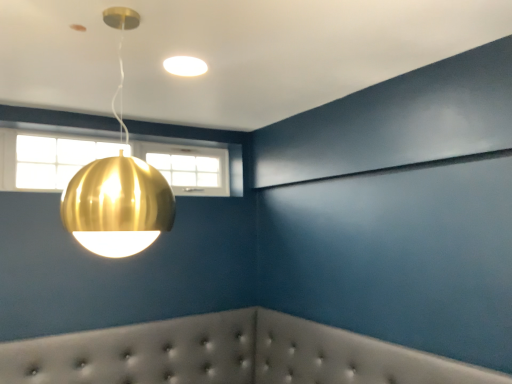
This screenshot has height=384, width=512. Describe the element at coordinates (56, 160) in the screenshot. I see `clear glass window at upper left` at that location.

I want to click on white tufted headboard at lower center, so click(228, 355).

Where is `gold metallic sphere at upper center, the 1th lamp from the bottom`? Image resolution: width=512 pixels, height=384 pixels. gold metallic sphere at upper center, the 1th lamp from the bottom is located at coordinates (117, 206).

Is gold metallic sphere at upper center, which appears as the first lamp when viewed from the front, wider or thinner than clear glass window at upper left?

Clearly, gold metallic sphere at upper center, which appears as the first lamp when viewed from the front, has more width compared to clear glass window at upper left.

From the image's perspective, is gold metallic sphere at upper center, positioned as the 2th lamp in back-to-front order, over clear glass window at upper left?

No, from the image's perspective, gold metallic sphere at upper center, positioned as the 2th lamp in back-to-front order, is not on top of clear glass window at upper left.

Is gold metallic sphere at upper center, the 2th lamp positioned from the top, oriented towards clear glass window at upper left?

No.

You are a GUI agent. You are given a task and a screenshot of the screen. Output one action in this format:
    pyautogui.click(x=<x>, y=<y>)
    Task: Click on the lamp that appears on the right of gold metallic sphere at upper center, which appears as the first lamp when viewed from the front
    
    Given the screenshot: What is the action you would take?
    pyautogui.click(x=185, y=66)

From the image's perspective, is matte white light fixture at upper center, the second lamp from the bottom, located beneath gold metallic sphere at upper center, the 2th lamp positioned from the top?

No.

Who is shorter, matte white light fixture at upper center, the first lamp in the top-to-bottom sequence, or gold metallic sphere at upper center, the 2th lamp positioned from the top?

Standing shorter between the two is matte white light fixture at upper center, the first lamp in the top-to-bottom sequence.

From a real-world perspective, relative to clear glass window at upper left, is matte white light fixture at upper center, the first lamp in the top-to-bottom sequence, vertically above or below?

In terms of real-world spatial position, matte white light fixture at upper center, the first lamp in the top-to-bottom sequence, is above clear glass window at upper left.

From the image's perspective, does matte white light fixture at upper center, the first lamp in the top-to-bottom sequence, appear lower than clear glass window at upper left?

No.

Does matte white light fixture at upper center, which ranks as the second lamp in front-to-back order, turn towards clear glass window at upper left?

No, matte white light fixture at upper center, which ranks as the second lamp in front-to-back order, is not aimed at clear glass window at upper left.

Is white tufted headboard at lower center situated inside gold metallic sphere at upper center, which appears as the first lamp when viewed from the front, or outside?

white tufted headboard at lower center is not inside gold metallic sphere at upper center, which appears as the first lamp when viewed from the front, it's outside.

Are white tufted headboard at lower center and gold metallic sphere at upper center, positioned as the 2th lamp in back-to-front order, located far from each other?

Yes.

Which is in front, white tufted headboard at lower center or gold metallic sphere at upper center, the 1th lamp from the bottom?

gold metallic sphere at upper center, the 1th lamp from the bottom.

Is clear glass window at upper left inside the boundaries of white tufted headboard at lower center, or outside?

clear glass window at upper left lies outside white tufted headboard at lower center.

This screenshot has height=384, width=512. What are the coordinates of `furniture on the right of the clear glass window at upper left` in the screenshot? It's located at (228, 355).

Considering the positions of objects clear glass window at upper left and white tufted headboard at lower center in the image provided, who is more to the left, clear glass window at upper left or white tufted headboard at lower center?

clear glass window at upper left is more to the left.

How different are the orientations of gold metallic sphere at upper center, positioned as the 2th lamp in back-to-front order, and matte white light fixture at upper center, the second lamp from the bottom, in degrees?

90 degrees separate the facing orientations of gold metallic sphere at upper center, positioned as the 2th lamp in back-to-front order, and matte white light fixture at upper center, the second lamp from the bottom.

Who is bigger, gold metallic sphere at upper center, which appears as the first lamp when viewed from the front, or matte white light fixture at upper center, the second lamp from the bottom?

With larger size is gold metallic sphere at upper center, which appears as the first lamp when viewed from the front.

From a real-world perspective, is gold metallic sphere at upper center, the 2th lamp positioned from the top, located higher than matte white light fixture at upper center, the first lamp in the top-to-bottom sequence?

No.

Does gold metallic sphere at upper center, positioned as the 2th lamp in back-to-front order, have a lesser height compared to matte white light fixture at upper center, which is counted as the 1th lamp, starting from the back?

No.

Does white tufted headboard at lower center appear on the left side of clear glass window at upper left?

No, white tufted headboard at lower center is not to the left of clear glass window at upper left.

Would you say white tufted headboard at lower center contains clear glass window at upper left?

Actually, clear glass window at upper left is outside white tufted headboard at lower center.

Between white tufted headboard at lower center and clear glass window at upper left, which one has larger size?

white tufted headboard at lower center is bigger.

Is white tufted headboard at lower center positioned with its back to clear glass window at upper left?

No, clear glass window at upper left is not at the back of white tufted headboard at lower center.

I want to click on window behind the gold metallic sphere at upper center, the 2th lamp positioned from the top, so tap(56, 160).

Locate an element on the screen. lamp that appears above the gold metallic sphere at upper center, the 1th lamp from the bottom (from a real-world perspective) is located at coordinates (185, 66).

From the image, which object appears to be nearer to gold metallic sphere at upper center, which appears as the first lamp when viewed from the front, white tufted headboard at lower center or clear glass window at upper left?

The object closer to gold metallic sphere at upper center, which appears as the first lamp when viewed from the front, is clear glass window at upper left.

Looking at the image, which one is located further to clear glass window at upper left, gold metallic sphere at upper center, the 1th lamp from the bottom, or white tufted headboard at lower center?

Among the two, gold metallic sphere at upper center, the 1th lamp from the bottom, is located further to clear glass window at upper left.

Which object lies nearer to the anchor point white tufted headboard at lower center, clear glass window at upper left or gold metallic sphere at upper center, positioned as the 2th lamp in back-to-front order?

clear glass window at upper left.

Which object lies nearer to the anchor point clear glass window at upper left, white tufted headboard at lower center or matte white light fixture at upper center, which ranks as the second lamp in front-to-back order?

matte white light fixture at upper center, which ranks as the second lamp in front-to-back order, lies closer to clear glass window at upper left than the other object.

Which object lies nearer to the anchor point gold metallic sphere at upper center, the 1th lamp from the bottom, matte white light fixture at upper center, which is counted as the 1th lamp, starting from the back, or white tufted headboard at lower center?

matte white light fixture at upper center, which is counted as the 1th lamp, starting from the back, lies closer to gold metallic sphere at upper center, the 1th lamp from the bottom, than the other object.

Considering their positions, is white tufted headboard at lower center positioned further to gold metallic sphere at upper center, which appears as the first lamp when viewed from the front, than matte white light fixture at upper center, which is counted as the 1th lamp, starting from the back?

white tufted headboard at lower center.

Looking at the image, which one is located further to gold metallic sphere at upper center, positioned as the 2th lamp in back-to-front order, clear glass window at upper left or matte white light fixture at upper center, the second lamp from the bottom?

clear glass window at upper left lies further to gold metallic sphere at upper center, positioned as the 2th lamp in back-to-front order, than the other object.

From the image, which object appears to be nearer to clear glass window at upper left, matte white light fixture at upper center, the first lamp in the top-to-bottom sequence, or gold metallic sphere at upper center, the 2th lamp positioned from the top?

matte white light fixture at upper center, the first lamp in the top-to-bottom sequence, is positioned closer to the anchor clear glass window at upper left.

This screenshot has width=512, height=384. Find the location of `lamp between matte white light fixture at upper center, the second lamp from the bottom, and white tufted headboard at lower center in the up-down direction`. lamp between matte white light fixture at upper center, the second lamp from the bottom, and white tufted headboard at lower center in the up-down direction is located at coordinates (117, 206).

You are a GUI agent. You are given a task and a screenshot of the screen. Output one action in this format:
    pyautogui.click(x=<x>, y=<y>)
    Task: Click on the furniture located between gold metallic sphere at upper center, positioned as the 2th lamp in back-to-front order, and clear glass window at upper left in the depth direction
    
    Given the screenshot: What is the action you would take?
    pyautogui.click(x=228, y=355)

Find the location of a particular element. This screenshot has height=384, width=512. window between matte white light fixture at upper center, the first lamp in the top-to-bottom sequence, and white tufted headboard at lower center vertically is located at coordinates pos(56,160).

This screenshot has height=384, width=512. What are the coordinates of `lamp located between gold metallic sphere at upper center, the 2th lamp positioned from the top, and clear glass window at upper left in the depth direction` in the screenshot? It's located at (185, 66).